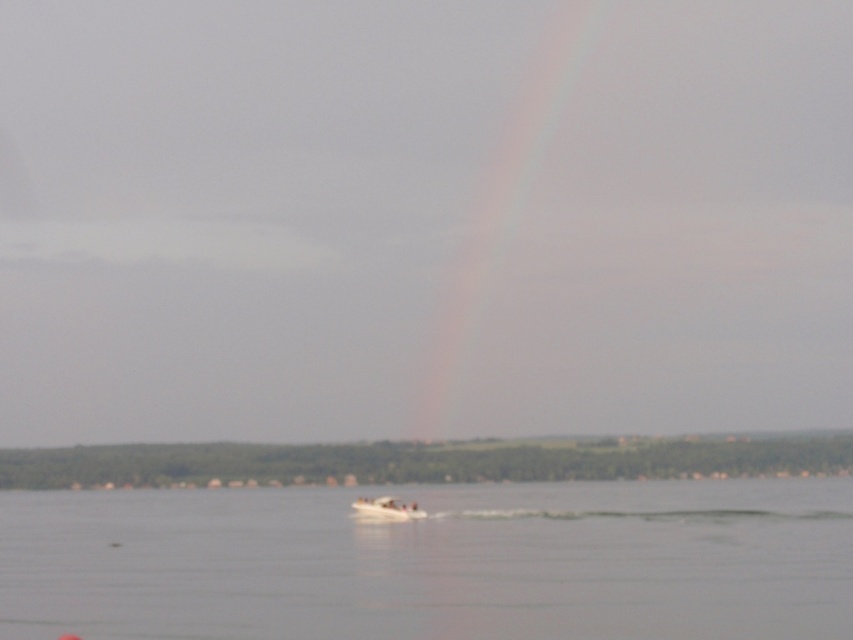
Is clear water at lower center closer to the viewer compared to rainbow at center?

Yes, clear water at lower center is in front of rainbow at center.

Is point (347, 566) farther from viewer compared to point (440, 416)?

That is False.

What do you see at coordinates (433, 563) in the screenshot? I see `clear water at lower center` at bounding box center [433, 563].

At what (x,y) coordinates should I click in order to perform the action: click on clear water at lower center. Please return your answer as a coordinate pair (x, y). Image resolution: width=853 pixels, height=640 pixels. Looking at the image, I should click on (433, 563).

Is clear water at lower center smaller than white plastic boat at center?

Result: No.

Can you confirm if clear water at lower center is bigger than white plastic boat at center?

Indeed, clear water at lower center has a larger size compared to white plastic boat at center.

Does point (375, 614) come farther from viewer compared to point (387, 513)?

No, (375, 614) is closer to viewer.

This screenshot has width=853, height=640. I want to click on clear water at lower center, so click(x=433, y=563).

Between rainbow at center and white plastic boat at center, which one appears on the left side from the viewer's perspective?

white plastic boat at center

Who is more distant from viewer, (468, 312) or (408, 518)?

Point (468, 312)

The height and width of the screenshot is (640, 853). What are the coordinates of `rainbow at center` in the screenshot? It's located at (502, 202).

This screenshot has height=640, width=853. I want to click on rainbow at center, so click(502, 202).